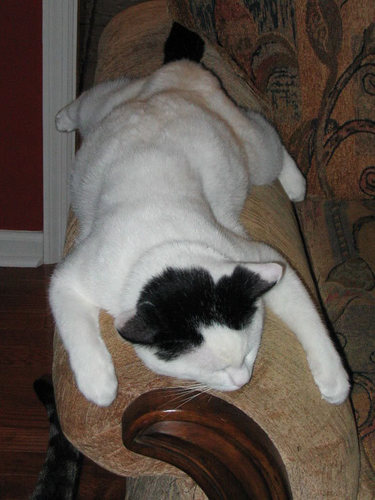
This screenshot has height=500, width=375. I want to click on wood floor, so click(14, 362).